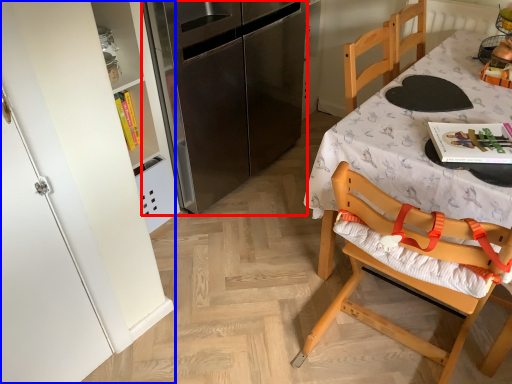
Question: Among these objects, which one is farthest to the camera, refrigerator (highlighted by a red box) or cabinetry (highlighted by a blue box)?

Choices:
 (A) refrigerator
 (B) cabinetry

Answer: (A)